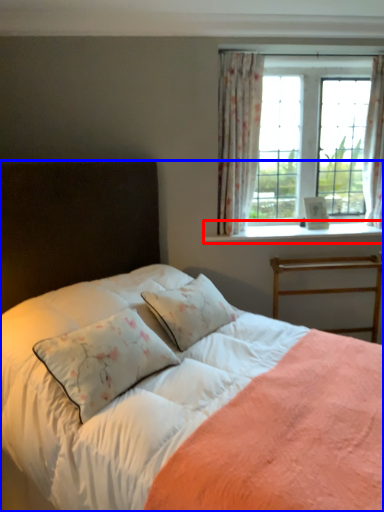
Question: Which of the following is the closest to the observer, window sill (highlighted by a red box) or bed (highlighted by a blue box)?

Choices:
 (A) window sill
 (B) bed

Answer: (B)